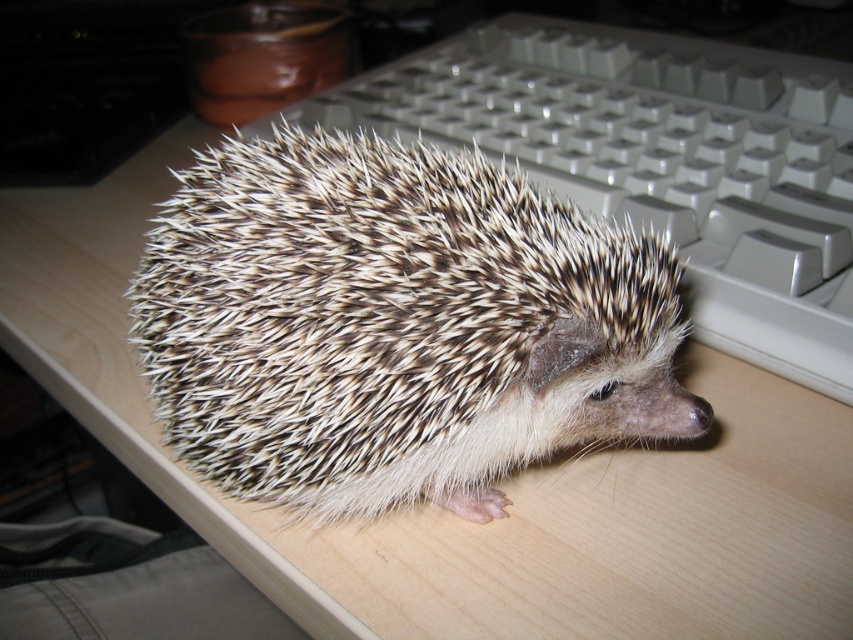
In the scene shown: You are organizing your desk and want to place a new keyboard. The current white plastic keyboard at upper right is in the way of the spiky brown hedgehog at center. Can you move the keyboard to make space for the hedgehog?

The spiky brown hedgehog at center is in front of the white plastic keyboard at upper right, meaning the keyboard is behind the hedgehog. To make space, you can move the keyboard to another location on the desk where it won not obstruct the hedgehog.

You are organizing items on your desk and need to place both the spiky brown hedgehog at center and the white plastic keyboard at upper right. Given their sizes, which item can you fit into a 20 cm wide drawer without bending?

The spiky brown hedgehog at center can fit into the 20 cm wide drawer since its width is less than the white plastic keyboard at upper right, which likely exceeds the drawer size.